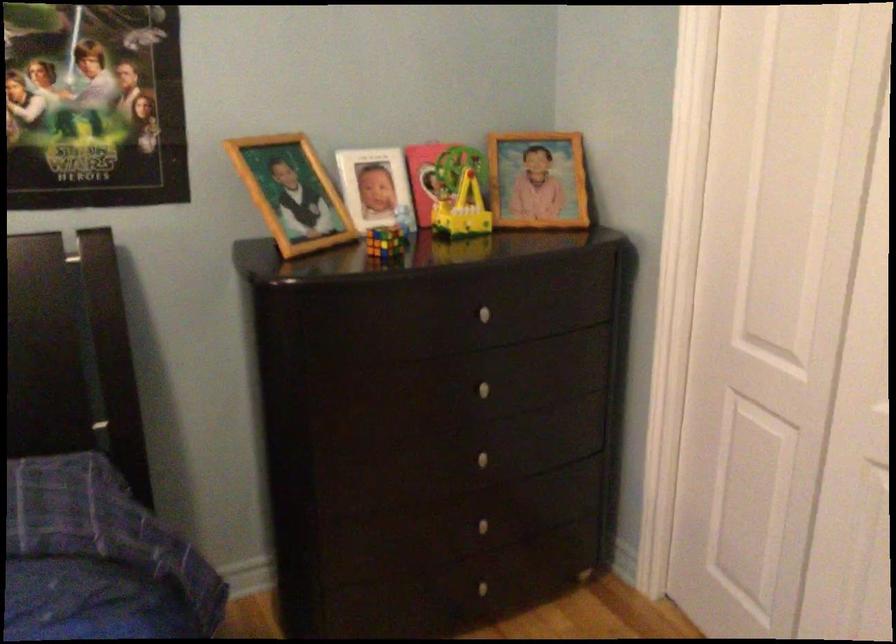
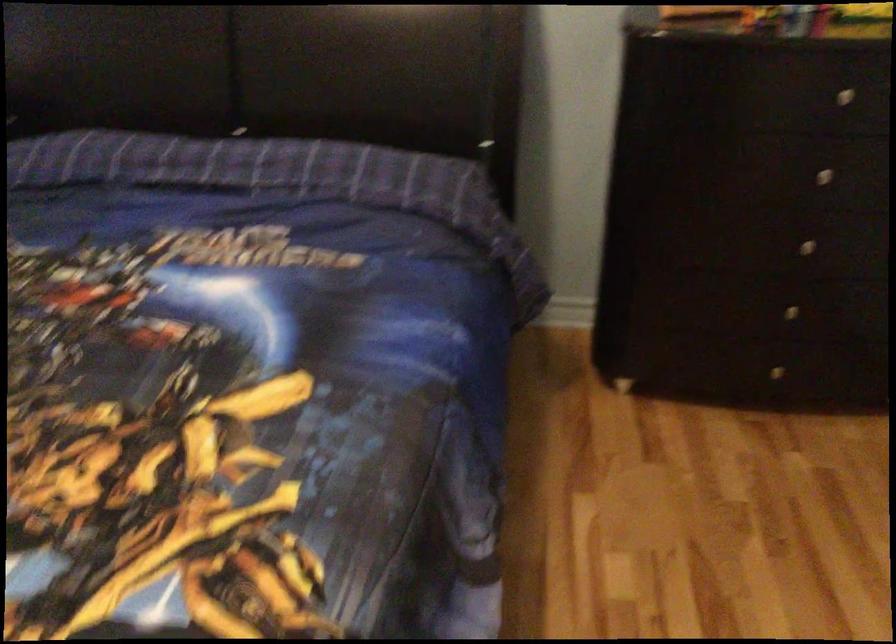
Where in the second image is the point corresponding to [488,457] from the first image?

(805, 245)